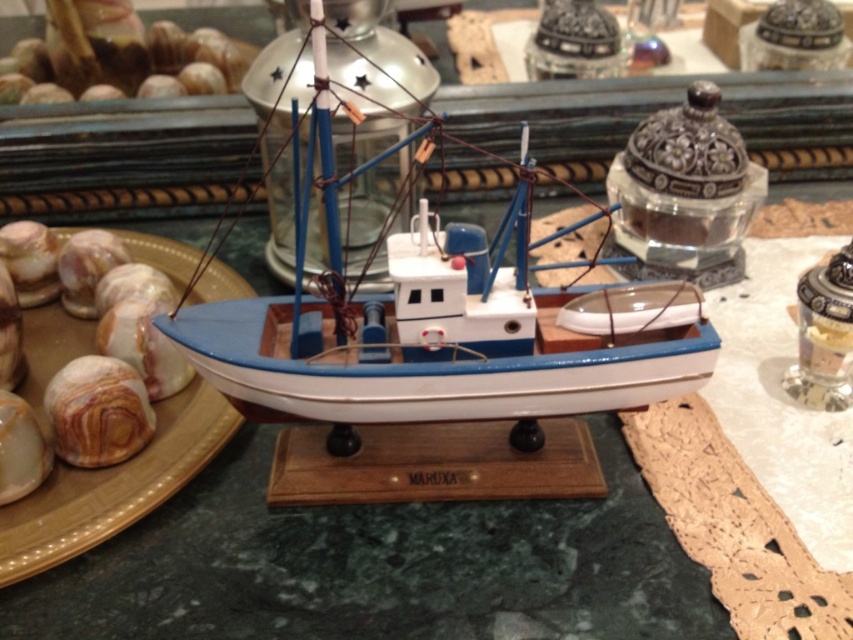
From the picture: You are a collector examining a display case containing a matte blue wooden boat at center and a matte brown plate at left. You want to know if the boat can fit into a storage box designed for items no taller than the plate. Based on their heights, would the boat fit?

The matte blue wooden boat at center is much taller than the matte brown plate at left, so it would not fit into a storage box designed for items no taller than the plate.

You are arranging a display in a museum and need to place the matte blue wooden boat at center and the matte brown plate at left. The museum requires that all items must be at least 30 centimeters apart for safety. Based on the image, will the current placement meet the requirement?

The matte blue wooden boat at center is 25.47 centimeters away from the matte brown plate at left, which is less than the required 30 centimeters. Therefore, the current placement does not meet the museum safety requirement.